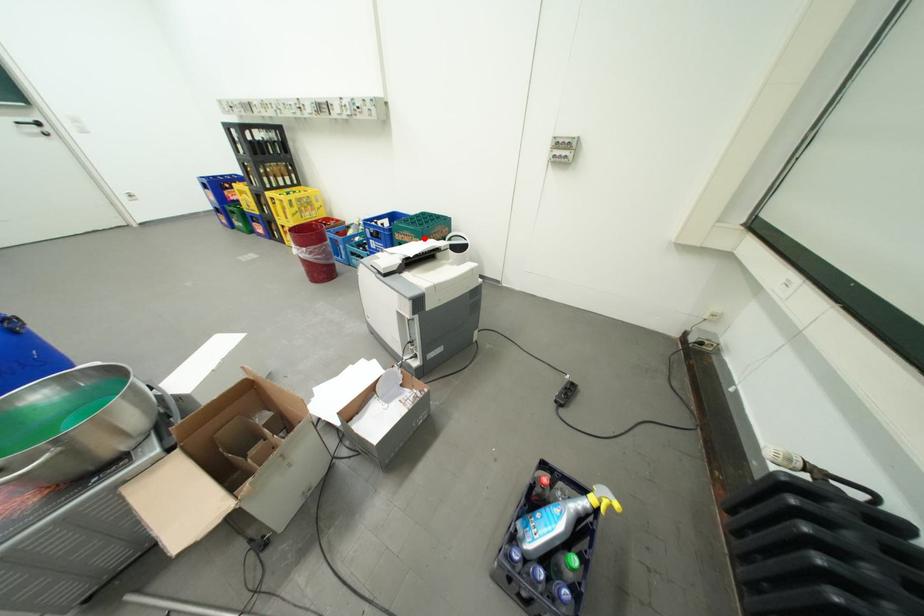
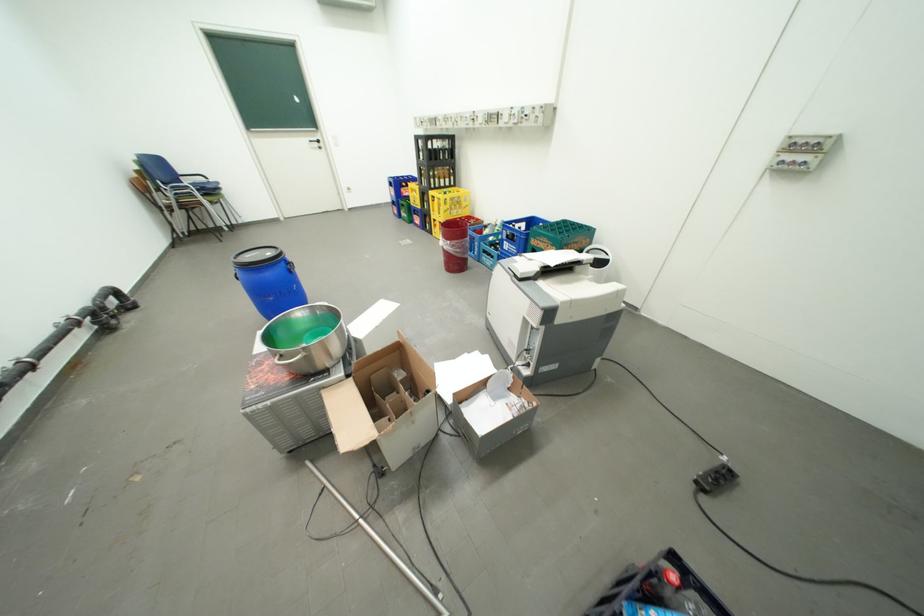
Find the pixel in the second image that matches the highlighted location in the first image.

(562, 246)